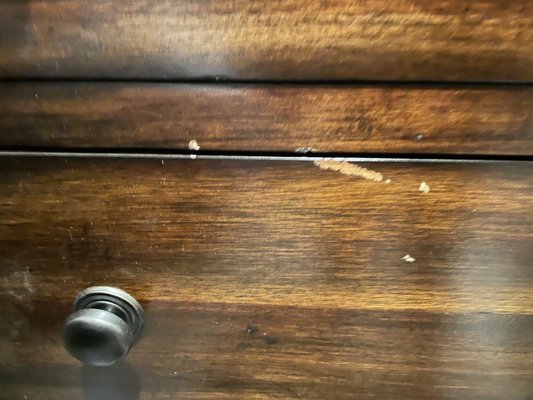
Image resolution: width=533 pixels, height=400 pixels. Identify the location of door knob. (98, 333).